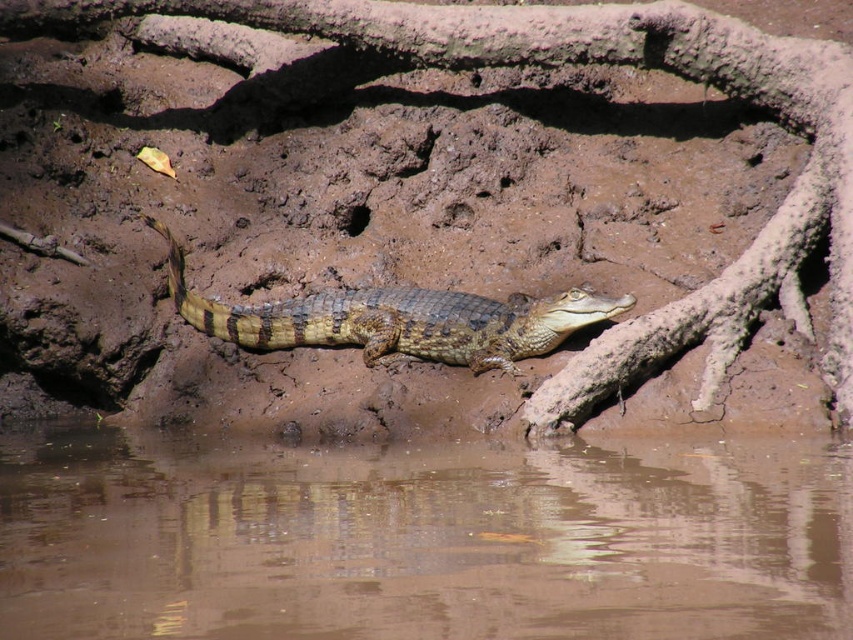
Is point (76, 493) positioned behind point (517, 35)?

No, it is in front of (517, 35).

Which of these two, brown muddy water at lower center or brown mud at center, stands shorter?

brown muddy water at lower center

At what (x,y) coordinates should I click in order to perform the action: click on brown muddy water at lower center. Please return your answer as a coordinate pair (x, y). Looking at the image, I should click on (422, 541).

Between brown mud at center and brown scaly crocodile at center, which one has less height?

brown scaly crocodile at center

Consider the image. Does brown mud at center have a lesser width compared to brown scaly crocodile at center?

Incorrect, brown mud at center's width is not less than brown scaly crocodile at center's.

Measure the distance between point (231, 19) and camera.

Point (231, 19) is 27.36 feet away from camera.

At what (x,y) coordinates should I click in order to perform the action: click on brown mud at center. Please return your answer as a coordinate pair (x, y). Looking at the image, I should click on (612, 61).

In the scene shown: Can you confirm if brown muddy water at lower center is thinner than brown scaly crocodile at center?

Incorrect, brown muddy water at lower center's width is not less than brown scaly crocodile at center's.

Does point (0, 634) come behind point (344, 300)?

No.

You are a GUI agent. You are given a task and a screenshot of the screen. Output one action in this format:
    pyautogui.click(x=<x>, y=<y>)
    Task: Click on the brown muddy water at lower center
    
    Given the screenshot: What is the action you would take?
    pyautogui.click(x=422, y=541)